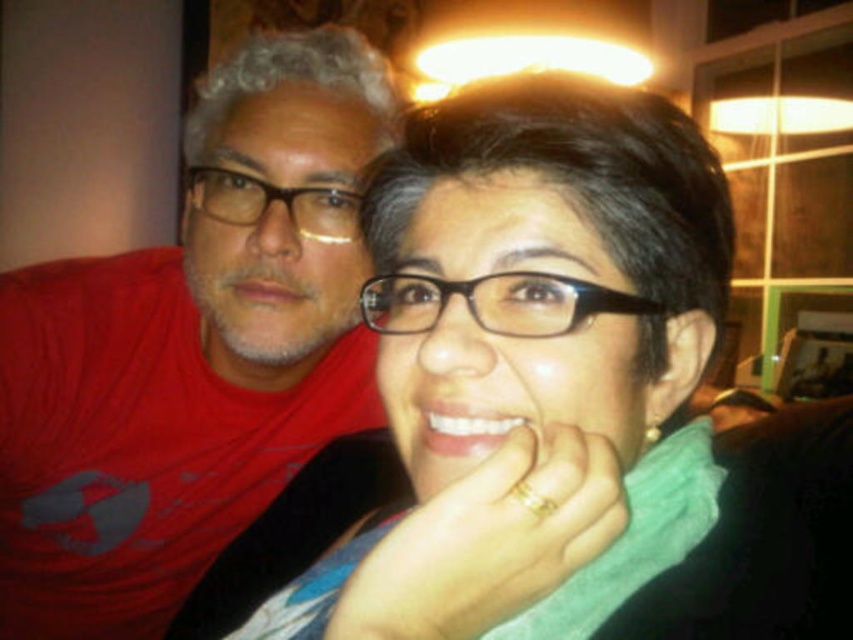
Is black plastic glasses at center wider than matte black glasses at upper left?

No.

Who is more distant from viewer, (422, 305) or (263, 205)?

Positioned behind is point (263, 205).

What do you see at coordinates (494, 301) in the screenshot?
I see `black plastic glasses at center` at bounding box center [494, 301].

Identify the location of black plastic glasses at center. The width and height of the screenshot is (853, 640). (494, 301).

Identify the location of matte black glasses at center. (537, 346).

Who is positioned more to the left, matte black glasses at center or black plastic glasses at center?

Positioned to the left is black plastic glasses at center.

Does point (479, 579) come behind point (502, 305)?

No, it is not.

Find the location of a particular element. This screenshot has width=853, height=640. matte black glasses at center is located at coordinates [537, 346].

Locate an element on the screen. matte black glasses at center is located at coordinates (537, 346).

Who is taller, matte black glasses at center or matte black glasses at upper left?

Standing taller between the two is matte black glasses at center.

Identify the location of matte black glasses at center. (537, 346).

Identify the location of matte black glasses at center. The image size is (853, 640). (537, 346).